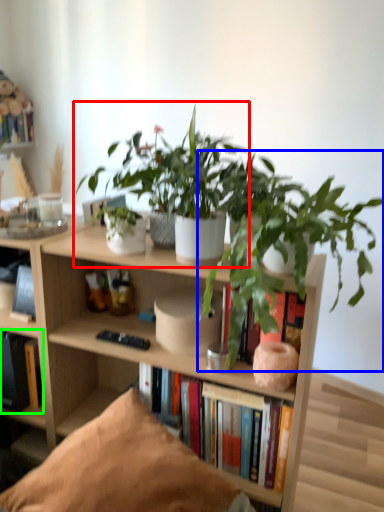
Question: Based on their relative distances, which object is farther from houseplant (highlighted by a red box)? Choose from houseplant (highlighted by a blue box) and book (highlighted by a green box).

Choices:
 (A) houseplant
 (B) book

Answer: (B)